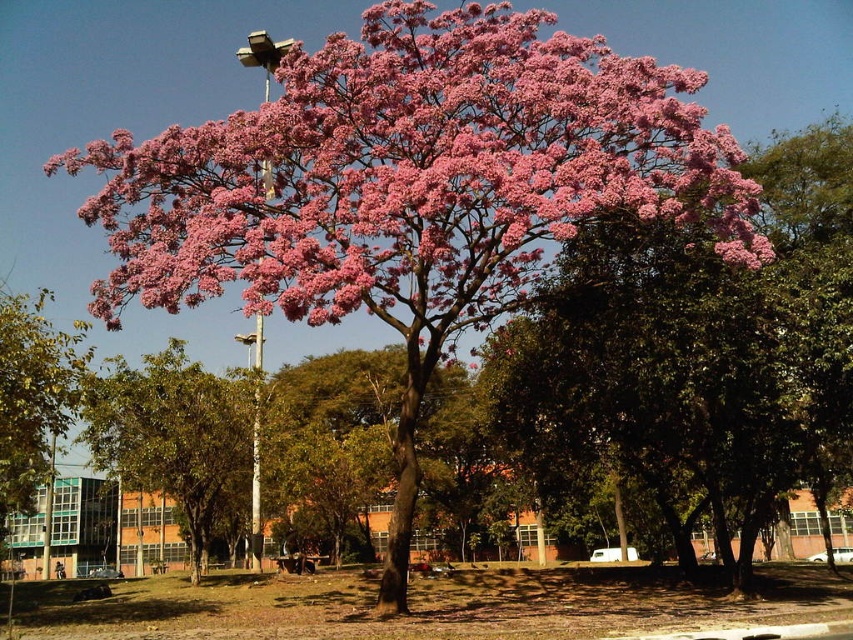
You are standing in front of the large pink blossomed tree and notice two points marked in the scene. The first point is at coordinate point (457, 12) and the second is at point (24, 333). Which point is closer to you?

Point (457, 12) is further to the camera than point (24, 333), so the second point is closer to you.

You are standing in a garden and want to take a photo of the pink matte flower at upper center without the green leafy tree at lower left blocking it. Is this possible?

Yes, because the pink matte flower at upper center is in front of the green leafy tree at lower left, so it won not be blocked by it.